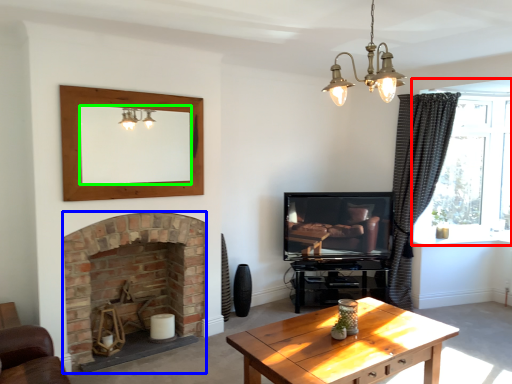
Question: Based on their relative distances, which object is nearer to window (highlighted by a red box)? Choose from fireplace (highlighted by a blue box) and mirror (highlighted by a green box).

Choices:
 (A) fireplace
 (B) mirror

Answer: (B)